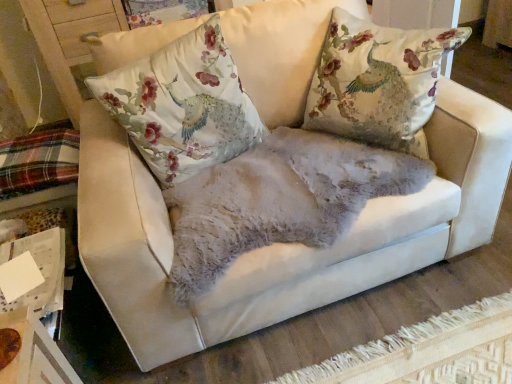
The image size is (512, 384). What are the coordinates of `plaid fabric at lower left` in the screenshot? It's located at (38, 161).

The width and height of the screenshot is (512, 384). What do you see at coordinates (38, 161) in the screenshot?
I see `plaid fabric at lower left` at bounding box center [38, 161].

The height and width of the screenshot is (384, 512). What do you see at coordinates (183, 105) in the screenshot? I see `silk floral cushion at center` at bounding box center [183, 105].

Locate an element on the screen. The height and width of the screenshot is (384, 512). silk floral cushion at center is located at coordinates (183, 105).

Locate an element on the screen. plaid fabric at lower left is located at coordinates (38, 161).

Is silk floral cushion at center at the left side of plaid fabric at lower left?

No.

In the image, is silk floral cushion at center positioned in front of or behind plaid fabric at lower left?

silk floral cushion at center is positioned closer to the viewer than plaid fabric at lower left.

Which is closer to the camera, (221, 135) or (5, 183)?

Point (221, 135).

From the image's perspective, which one is positioned higher, silk floral cushion at center or plaid fabric at lower left?

silk floral cushion at center appears higher in the image.

From a real-world perspective, is silk floral cushion at center physically above plaid fabric at lower left?

Correct, in the physical world, silk floral cushion at center is higher than plaid fabric at lower left.

Considering the relative sizes of silk floral cushion at center and plaid fabric at lower left in the image provided, is silk floral cushion at center wider than plaid fabric at lower left?

No, silk floral cushion at center is not wider than plaid fabric at lower left.

Between silk floral cushion at center and plaid fabric at lower left, which one has less height?

With less height is plaid fabric at lower left.

Does silk floral cushion at center have a smaller size compared to plaid fabric at lower left?

No.

In the scene shown: Would you say silk floral cushion at center is outside plaid fabric at lower left?

silk floral cushion at center lies outside plaid fabric at lower left's area.

Is silk floral cushion at center with plaid fabric at lower left?

No, silk floral cushion at center is not beside plaid fabric at lower left.

Is silk floral cushion at center looking in the opposite direction of plaid fabric at lower left?

No, silk floral cushion at center is not facing away from plaid fabric at lower left.

This screenshot has width=512, height=384. Identify the location of bedding below the silk floral cushion at center (from a real-world perspective). (38, 161).

Is plaid fabric at lower left to the left of silk floral cushion at center from the viewer's perspective?

Correct, you'll find plaid fabric at lower left to the left of silk floral cushion at center.

Considering their positions, is plaid fabric at lower left located in front of or behind silk floral cushion at center?

plaid fabric at lower left is positioned farther from the viewer than silk floral cushion at center.

Does point (59, 149) appear closer or farther from the camera than point (169, 121)?

Point (59, 149) appears to be farther away from the viewer than point (169, 121).

From the image's perspective, relative to silk floral cushion at center, is plaid fabric at lower left above or below?

plaid fabric at lower left is situated lower than silk floral cushion at center in the image.

From a real-world perspective, is plaid fabric at lower left above or below silk floral cushion at center?

From a real-world perspective, plaid fabric at lower left is physically below silk floral cushion at center.

Which object is wider, plaid fabric at lower left or silk floral cushion at center?

Wider between the two is plaid fabric at lower left.

Does plaid fabric at lower left have a lesser height compared to silk floral cushion at center?

Yes.

Considering the relative sizes of plaid fabric at lower left and silk floral cushion at center in the image provided, is plaid fabric at lower left bigger than silk floral cushion at center?

Incorrect, plaid fabric at lower left is not larger than silk floral cushion at center.

Do you think plaid fabric at lower left is within silk floral cushion at center, or outside of it?

The correct answer is: outside.

Is plaid fabric at lower left in contact with silk floral cushion at center?

plaid fabric at lower left is not next to silk floral cushion at center, and they're not touching.

Is plaid fabric at lower left turned away from silk floral cushion at center?

No, plaid fabric at lower left's orientation is not away from silk floral cushion at center.

Can you tell me how much plaid fabric at lower left and silk floral cushion at center differ in facing direction?

They differ by 80.8 degrees in their facing directions.

You are a GUI agent. You are given a task and a screenshot of the screen. Output one action in this format:
    pyautogui.click(x=<x>, y=<y>)
    Task: Click on the pillow in front of the plaid fabric at lower left
    The height and width of the screenshot is (384, 512).
    Given the screenshot: What is the action you would take?
    pyautogui.click(x=183, y=105)

In order to click on bedding behind the silk floral cushion at center in this screenshot , I will do `click(38, 161)`.

I want to click on bedding on the left of silk floral cushion at center, so click(38, 161).